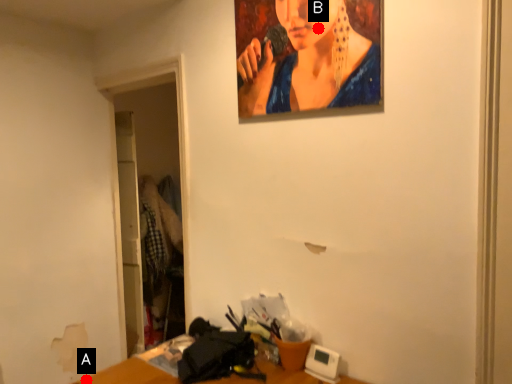
Question: Two points are circled on the image, labeled by A and B beside each circle. Which point is closer to the camera?

Choices:
 (A) A is closer
 (B) B is closer

Answer: (B)